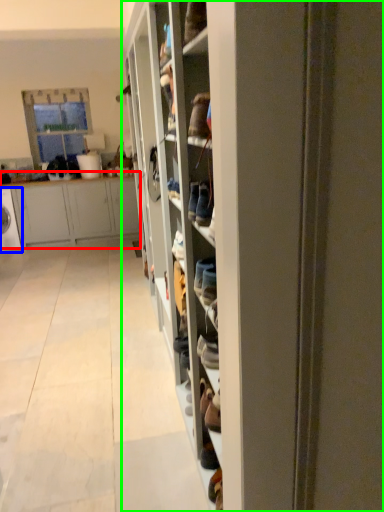
Question: Which is nearer to the cabinetry (highlighted by a red box)? washing machine (highlighted by a blue box) or shelf (highlighted by a green box).

Choices:
 (A) washing machine
 (B) shelf

Answer: (A)